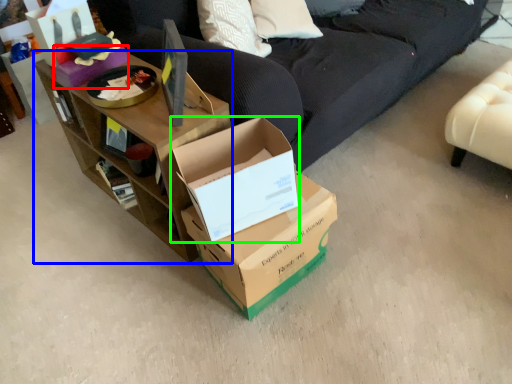
Question: Which is nearer to the box (highlighted by a red box)? shelf (highlighted by a blue box) or box (highlighted by a green box).

Choices:
 (A) shelf
 (B) box

Answer: (A)